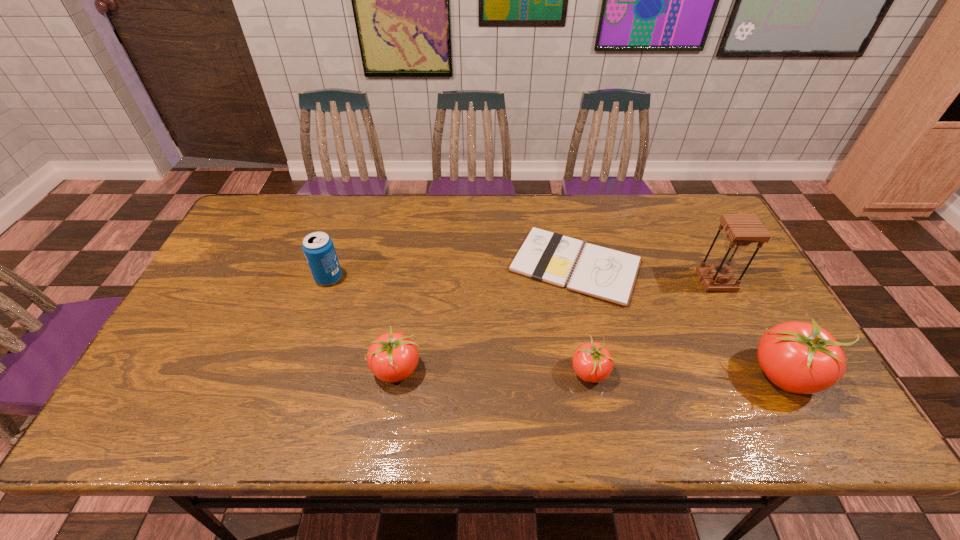
This screenshot has width=960, height=540. I want to click on free space that is in between the notepad and the second shortest object, so click(582, 319).

I want to click on the closest object to the notepad, so click(x=592, y=362).

Identify the location of object that stands as the closest to the soda can. The width and height of the screenshot is (960, 540). (392, 357).

Point out which tomato is positioned as the nearest to the leftmost tomato. Please provide its 2D coordinates. Your answer should be formatted as a tuple, i.e. [(x, y)], where the tuple contains the x and y coordinates of a point satisfying the conditions above.

[(592, 362)]

Locate an element on the screen. This screenshot has height=540, width=960. tomato that is the second closest to the third shortest object is located at coordinates (798, 357).

What are the coordinates of `free space that satisfies the following two spatial constraints: 1. on the front side of the tallest tomato; 2. on the right side of the notepad` in the screenshot? It's located at (598, 375).

Locate an element on the screen. This screenshot has width=960, height=540. free location that satisfies the following two spatial constraints: 1. on the back side of the shortest object; 2. on the right side of the fifth object from right to left is located at coordinates (411, 266).

Find the location of `vacant space that satisfies the following two spatial constraints: 1. on the front side of the second tallest tomato; 2. on the left side of the leftmost object`. vacant space that satisfies the following two spatial constraints: 1. on the front side of the second tallest tomato; 2. on the left side of the leftmost object is located at coordinates (299, 369).